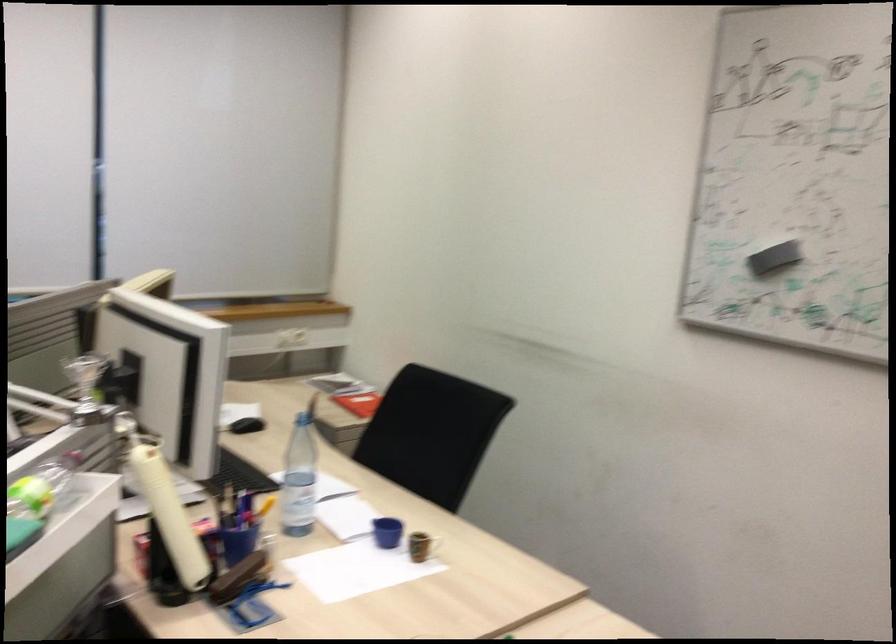
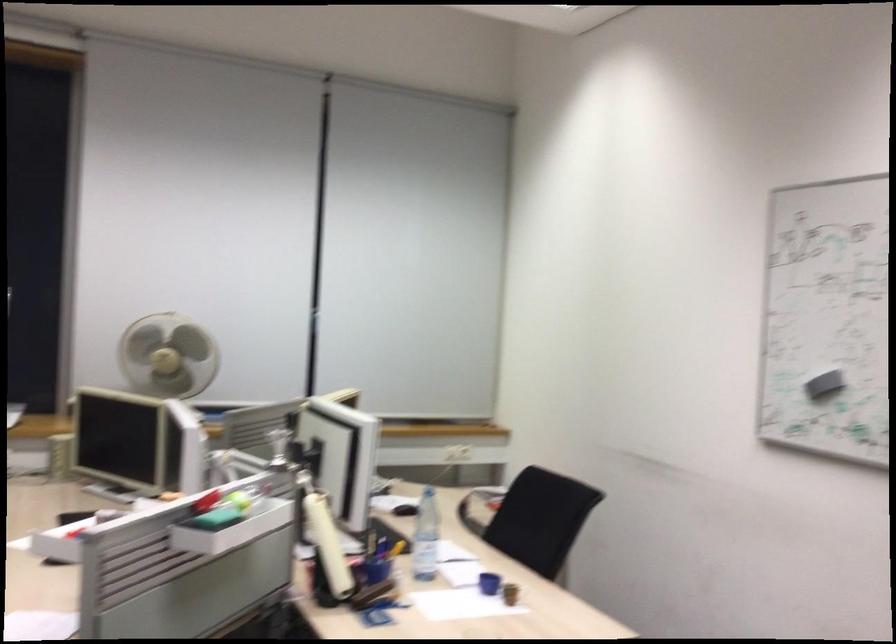
The point at (397,532) is marked in the first image. Where is the corresponding point in the second image?

(488, 583)